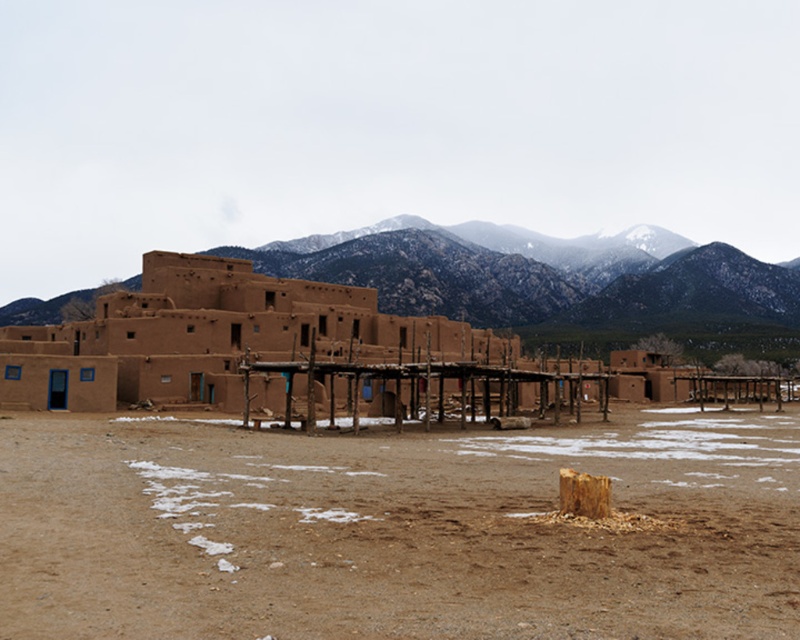
Which is behind, point (282, 244) or point (176, 314)?

Positioned behind is point (282, 244).

At what (x,y) coordinates should I click in order to perform the action: click on snow-covered rock formation at center. Please return your answer as a coordinate pair (x, y). Looking at the image, I should click on (556, 282).

Is brown sandy dirt at center to the right of adobe at center from the viewer's perspective?

Indeed, brown sandy dirt at center is positioned on the right side of adobe at center.

Which is above, brown sandy dirt at center or adobe at center?

adobe at center is above.

Locate an element on the screen. The image size is (800, 640). brown sandy dirt at center is located at coordinates (396, 531).

Identify the location of brown sandy dirt at center. (396, 531).

What do you see at coordinates (396, 531) in the screenshot? I see `brown sandy dirt at center` at bounding box center [396, 531].

Between brown sandy dirt at center and snow-covered rock formation at center, which one is positioned higher?

Positioned higher is snow-covered rock formation at center.

At what (x,y) coordinates should I click in order to perform the action: click on brown sandy dirt at center. Please return your answer as a coordinate pair (x, y). This screenshot has height=640, width=800. Looking at the image, I should click on (396, 531).